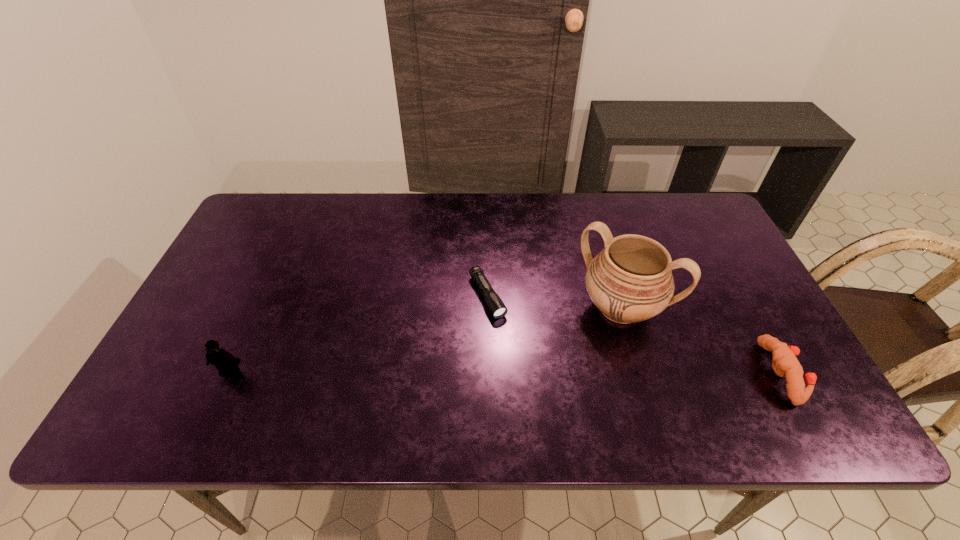
This screenshot has width=960, height=540. What are the coordinates of `vacant space located 0.110m on the front-facing side of the third object from left to right` in the screenshot? It's located at (577, 364).

I want to click on vacant space located 0.050m at the lens end of the shortest object, so click(x=504, y=333).

The width and height of the screenshot is (960, 540). Find the location of `vacant area situated at the lens end of the shortest object`. vacant area situated at the lens end of the shortest object is located at coordinates (520, 362).

Where is `vacant space located at the lens end of the shortest object`? vacant space located at the lens end of the shortest object is located at coordinates (528, 375).

This screenshot has height=540, width=960. What are the coordinates of `Lego that is at the near edge` in the screenshot? It's located at (225, 362).

Locate an element on the screen. The image size is (960, 540). puncher located in the near edge section of the desktop is located at coordinates click(785, 364).

Identify the location of object that is at the left edge. (225, 362).

In order to click on object at the right edge in this screenshot , I will do click(x=785, y=364).

Identify the location of object at the near left corner. (225, 362).

Where is `object at the near right corner`? This screenshot has height=540, width=960. object at the near right corner is located at coordinates (785, 364).